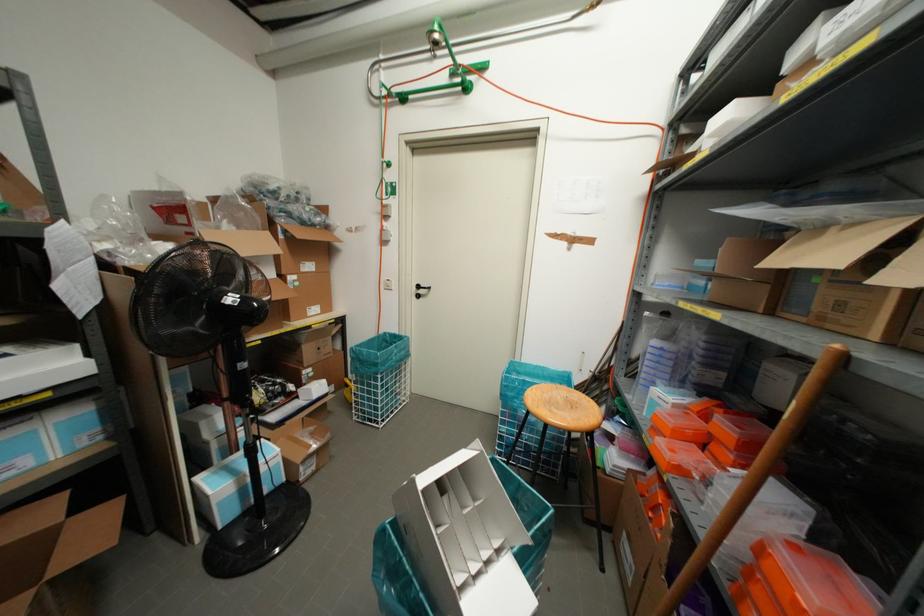
Where is `black door handle`? black door handle is located at coordinates (421, 288).